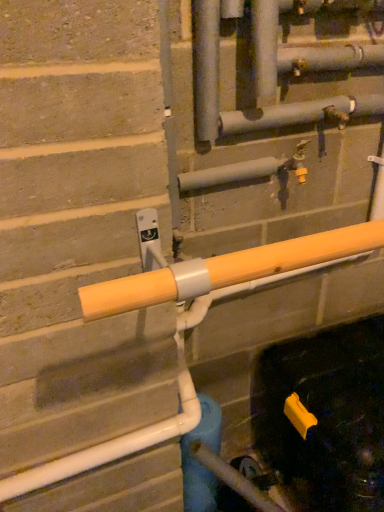
Question: Would you say blue matte water pipe at center is a long distance from yellow plastic faucet at center?

Choices:
 (A) no
 (B) yes

Answer: (A)

Question: Is the depth of blue matte water pipe at center less than that of yellow plastic faucet at center?

Choices:
 (A) no
 (B) yes

Answer: (A)

Question: Can you confirm if blue matte water pipe at center is smaller than yellow plastic faucet at center?

Choices:
 (A) yes
 (B) no

Answer: (B)

Question: From the image's perspective, is blue matte water pipe at center located beneath yellow plastic faucet at center?

Choices:
 (A) yes
 (B) no

Answer: (A)

Question: From a real-world perspective, is blue matte water pipe at center positioned over yellow plastic faucet at center based on gravity?

Choices:
 (A) yes
 (B) no

Answer: (B)

Question: Is blue matte water pipe at center to the right of yellow plastic faucet at center from the viewer's perspective?

Choices:
 (A) no
 (B) yes

Answer: (A)

Question: Does yellow matte pipe at center turn towards yellow plastic faucet at center?

Choices:
 (A) yes
 (B) no

Answer: (B)

Question: Is the position of yellow matte pipe at center more distant than that of yellow plastic faucet at center?

Choices:
 (A) yes
 (B) no

Answer: (B)

Question: Is yellow plastic faucet at center completely or partially inside yellow matte pipe at center?

Choices:
 (A) no
 (B) yes

Answer: (A)

Question: Is yellow matte pipe at center positioned beyond the bounds of yellow plastic faucet at center?

Choices:
 (A) no
 (B) yes

Answer: (B)

Question: Can you confirm if yellow matte pipe at center is shorter than yellow plastic faucet at center?

Choices:
 (A) no
 (B) yes

Answer: (B)

Question: Is yellow matte pipe at center next to yellow plastic faucet at center?

Choices:
 (A) no
 (B) yes

Answer: (A)

Question: Is yellow plastic faucet at center thinner than yellow matte pipe at center?

Choices:
 (A) no
 (B) yes

Answer: (B)